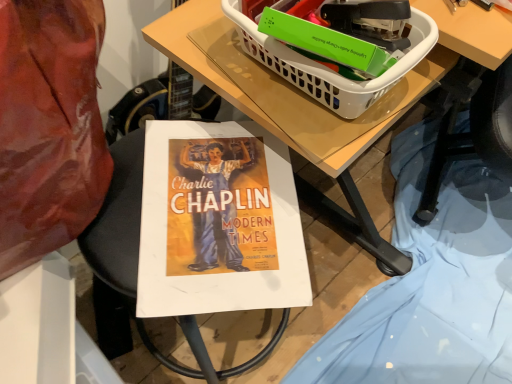
This screenshot has width=512, height=384. What do you see at coordinates (296, 111) in the screenshot?
I see `wooden table at center` at bounding box center [296, 111].

Identify the location of wooden table at center. The height and width of the screenshot is (384, 512). (296, 111).

Describe the element at coordinates (328, 68) in the screenshot. The image size is (512, 384). I see `white plastic basket at upper right` at that location.

What are the coordinates of `white plastic basket at upper right` in the screenshot? It's located at (328, 68).

This screenshot has width=512, height=384. What are the coordinates of `wooden table at center` in the screenshot? It's located at [x=296, y=111].

Can you confirm if white plastic basket at upper right is positioned to the left of wooden table at center?

Correct, you'll find white plastic basket at upper right to the left of wooden table at center.

Which object is further away from the camera taking this photo, white plastic basket at upper right or wooden table at center?

wooden table at center is more distant.

Between point (422, 20) and point (238, 97), which one is positioned in front?

The point (422, 20) is in front.

From the image's perspective, is white plastic basket at upper right located above or below wooden table at center?

Based on their image positions, white plastic basket at upper right is located above wooden table at center.

From a real-world perspective, is white plastic basket at upper right on wooden table at center?

Yes.

Which of these two, white plastic basket at upper right or wooden table at center, is thinner?

white plastic basket at upper right is thinner.

Consider the image. Is white plastic basket at upper right taller or shorter than wooden table at center?

Clearly, white plastic basket at upper right is taller compared to wooden table at center.

Between white plastic basket at upper right and wooden table at center, which one has smaller size?

Smaller between the two is white plastic basket at upper right.

Would you say white plastic basket at upper right contains wooden table at center?

No.

Does white plastic basket at upper right touch wooden table at center?

Yes, white plastic basket at upper right is right next to wooden table at center and making contact.

Is white plastic basket at upper right looking in the opposite direction of wooden table at center?

No, white plastic basket at upper right's orientation is not away from wooden table at center.

Find the location of a particular element. The height and width of the screenshot is (384, 512). basket in front of the wooden table at center is located at coordinates (328, 68).

Is wooden table at center to the left or to the right of white plastic basket at upper right in the image?

From the image, it's evident that wooden table at center is to the right of white plastic basket at upper right.

Which is in front, wooden table at center or white plastic basket at upper right?

Positioned in front is white plastic basket at upper right.

Which point is more distant from viewer, (316, 129) or (293, 2)?

The point (316, 129) is more distant.

From the image's perspective, is wooden table at center on white plastic basket at upper right?

No, from the image's perspective, wooden table at center is not on top of white plastic basket at upper right.

From a real-world perspective, which is physically above, wooden table at center or white plastic basket at upper right?

white plastic basket at upper right, from a real-world perspective.

Looking at their sizes, would you say wooden table at center is wider or thinner than white plastic basket at upper right?

Considering their sizes, wooden table at center looks broader than white plastic basket at upper right.

Looking at this image, considering the sizes of objects wooden table at center and white plastic basket at upper right in the image provided, who is taller, wooden table at center or white plastic basket at upper right?

With more height is white plastic basket at upper right.

Who is smaller, wooden table at center or white plastic basket at upper right?

white plastic basket at upper right.

Is wooden table at center surrounding white plastic basket at upper right?

Actually, white plastic basket at upper right is outside wooden table at center.

Are wooden table at center and white plastic basket at upper right far apart?

Actually, wooden table at center and white plastic basket at upper right are a little close together.

Is wooden table at center facing towards white plastic basket at upper right?

No.

Can you tell me how much wooden table at center and white plastic basket at upper right differ in facing direction?

79.2 degrees.

Measure the distance from wooden table at center to white plastic basket at upper right.

wooden table at center is 2.84 inches from white plastic basket at upper right.

Find the location of a particular element. The width and height of the screenshot is (512, 384). basket in front of the wooden table at center is located at coordinates (328, 68).

Find the location of a particular element. The height and width of the screenshot is (384, 512). basket lying on the left of wooden table at center is located at coordinates (328, 68).

Where is `table below the white plastic basket at upper right (from a real-world perspective)`? The image size is (512, 384). table below the white plastic basket at upper right (from a real-world perspective) is located at coordinates (296, 111).